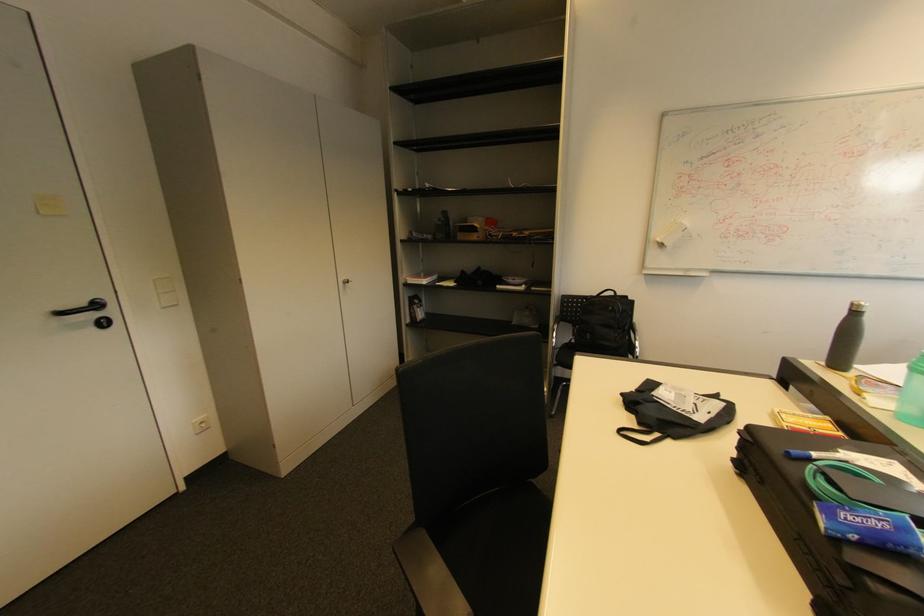
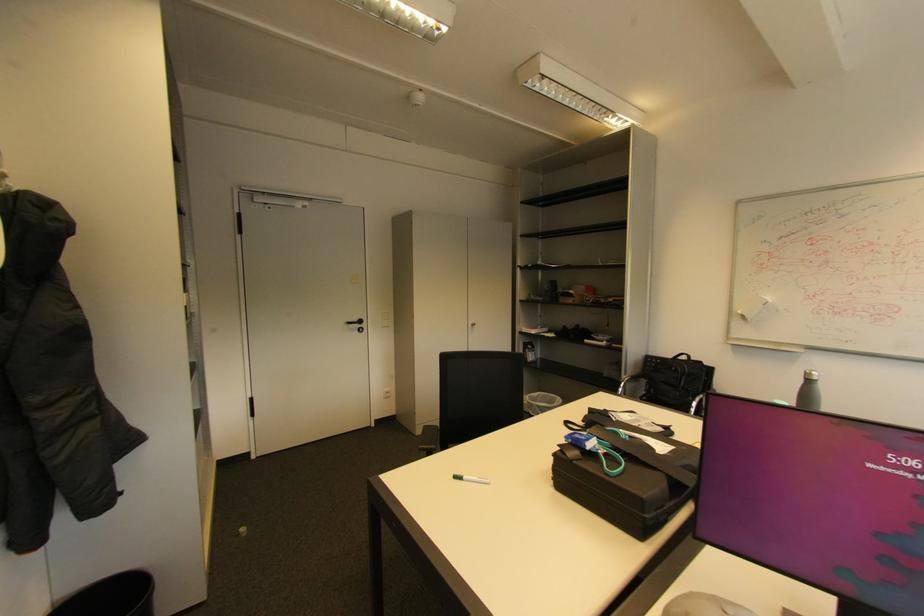
Find the pixel in the second image that matches point 103,305 in the first image.

(366, 322)